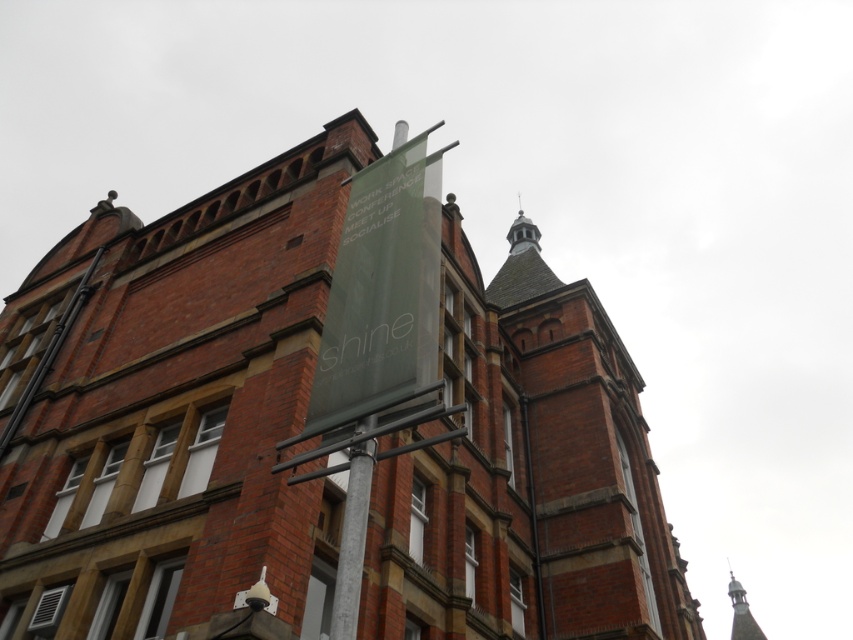
You are a delivery person trying to locate the entrance to the building. You see the green fabric banner at center and the red brick tower at upper center. According to the image, which object is closer to the left side of the building?

The green fabric banner at center is positioned on the left side of red brick tower at upper center, so it is closer to the left side of the building.